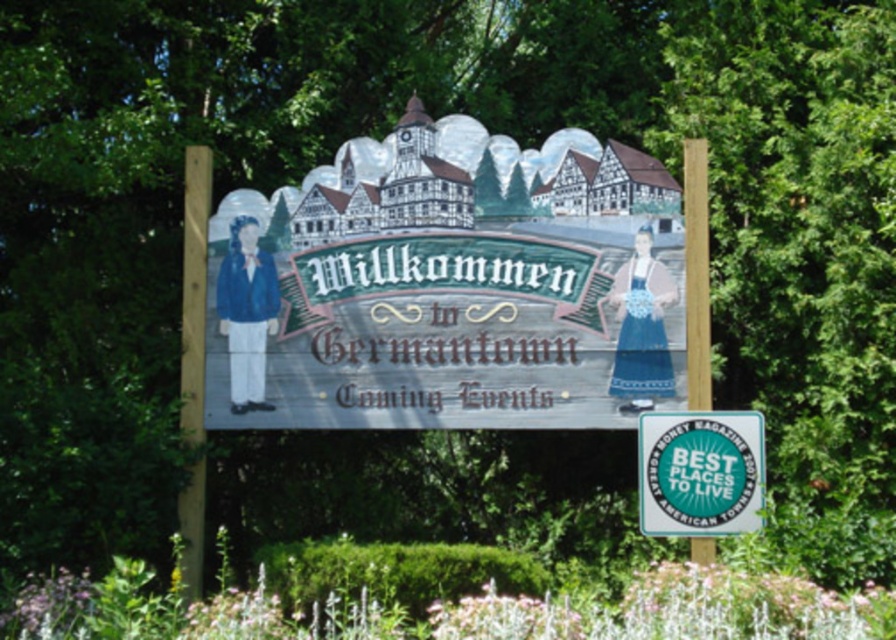
Question: Is the position of wooden signboard at center more distant than that of green glossy sign at center?

Choices:
 (A) no
 (B) yes

Answer: (B)

Question: Does wooden signboard at center lie behind green glossy sign at center?

Choices:
 (A) no
 (B) yes

Answer: (B)

Question: Which of the following is the closest to the observer?

Choices:
 (A) (670, 476)
 (B) (372, 204)

Answer: (A)

Question: Is wooden signboard at center to the right of green glossy sign at center from the viewer's perspective?

Choices:
 (A) yes
 (B) no

Answer: (B)